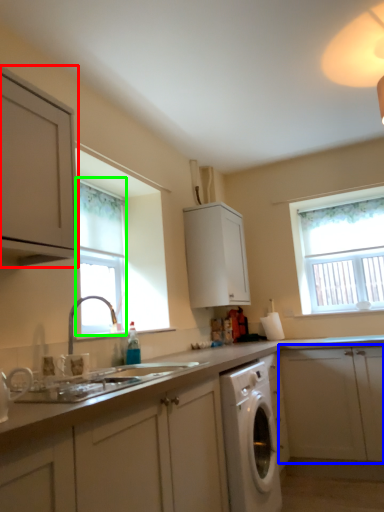
Question: Estimate the real-world distances between objects in this image. Which object is closer to cabinetry (highlighted by a red box), cabinetry (highlighted by a blue box) or window (highlighted by a green box)?

Choices:
 (A) cabinetry
 (B) window

Answer: (B)